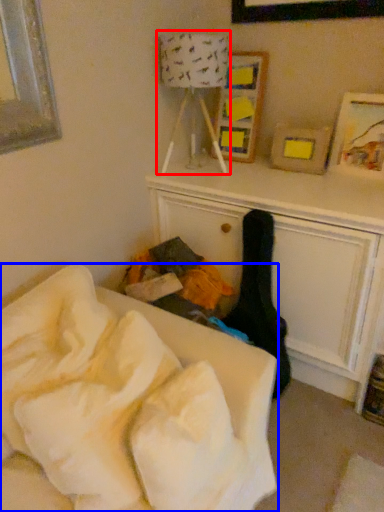
Question: Which point is further to the camera, lamp (highlighted by a red box) or furniture (highlighted by a blue box)?

Choices:
 (A) lamp
 (B) furniture

Answer: (A)